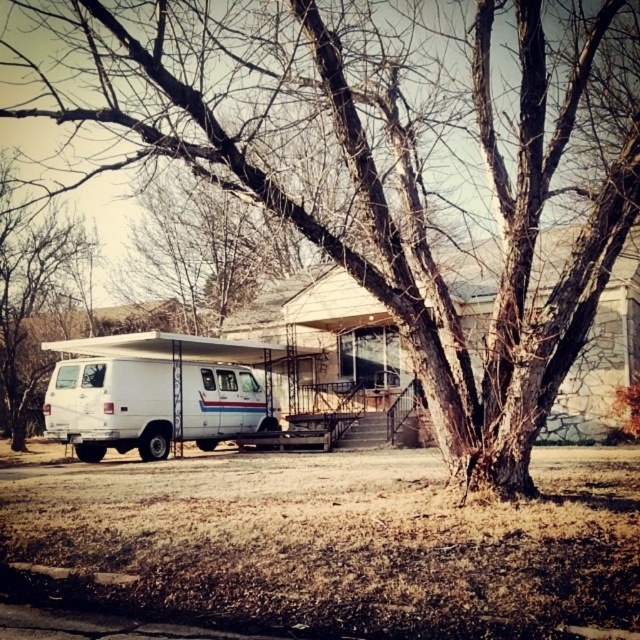
You are standing at the center of the image and want to walk to the white matte van at lower left. Based on the coordinates provided, in which direction should you move first?

The white matte van at lower left is located at point (109,404). Since you are at the center, you should move downward and to the right to reach it.

You are a delivery driver who needs to park your truck between the white matte van at lower left and the bare wood tree at left. Can you fit your truck, which is 2.5 meters wide, in the space between them?

The white matte van at lower left is thinner than the bare wood tree at left, but the description does not provide the exact width of the space between them. Therefore, it is unclear if the truck can fit. You should measure the space before attempting to park.